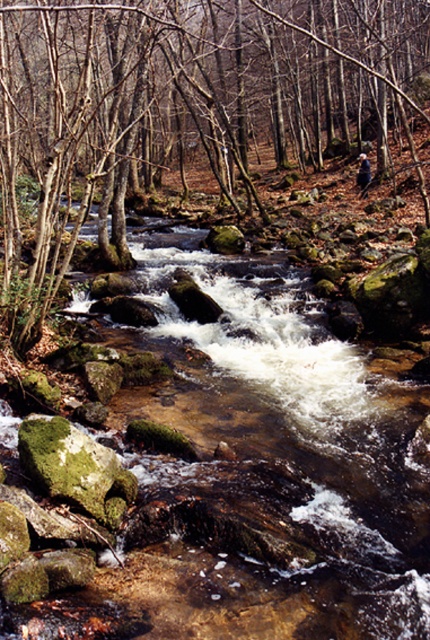
You are a hiker trying to cross the stream shown in the image. You notice the clear water at center and the green mossy rock at lower left. Which object should you avoid stepping on to ensure a safer crossing?

You should avoid stepping on the green mossy rock at lower left because the clear water at center is in front of it, making the rock slippery and less stable underfoot.

You are a hiker trying to cross the stream. You see clear water at center and green mossy rock at center. Which object should you step on to avoid getting your boots wet?

You should step on the green mossy rock at center because it is solid ground, while the clear water at center is a flowing stream and will get your boots wet.